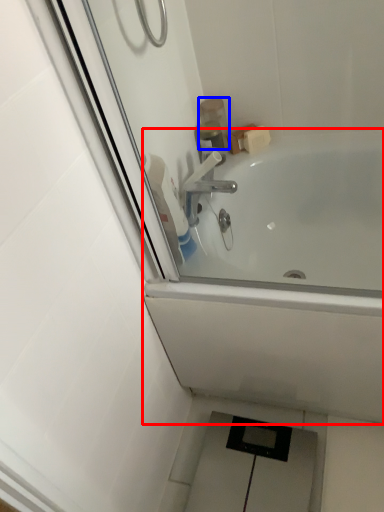
Question: Which point is closer to the camera, bathtub (highlighted by a red box) or toiletry (highlighted by a blue box)?

Choices:
 (A) bathtub
 (B) toiletry

Answer: (A)